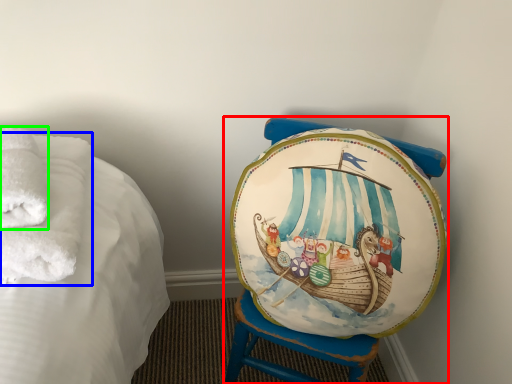
Question: Which is farther away from furniture (highlighted by a red box)? bath towel (highlighted by a blue box) or bath towel (highlighted by a green box)?

Choices:
 (A) bath towel
 (B) bath towel

Answer: (B)